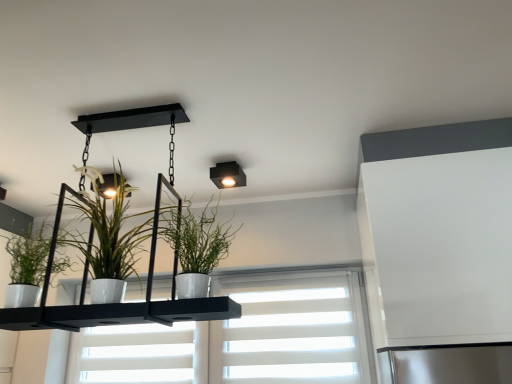
The width and height of the screenshot is (512, 384). What do you see at coordinates (26, 267) in the screenshot? I see `green matte plant at left, placed as the third houseplant when sorted from right to left` at bounding box center [26, 267].

The width and height of the screenshot is (512, 384). What do you see at coordinates (228, 175) in the screenshot? I see `matte black square light fixture at upper center` at bounding box center [228, 175].

Describe the element at coordinates (103, 234) in the screenshot. I see `white glossy pot at center, the 2th houseplant from the left` at that location.

Where is `green matte plant at left, placed as the third houseplant when sorted from right to left`? The width and height of the screenshot is (512, 384). green matte plant at left, placed as the third houseplant when sorted from right to left is located at coordinates (26, 267).

Considering the sizes of white glossy pot at center, which appears as the second houseplant when viewed from the right, and matte black square light fixture at upper center in the image, is white glossy pot at center, which appears as the second houseplant when viewed from the right, taller or shorter than matte black square light fixture at upper center?

Considering their sizes, white glossy pot at center, which appears as the second houseplant when viewed from the right, has more height than matte black square light fixture at upper center.

Considering the relative positions of white glossy pot at center, the 2th houseplant from the left, and matte black square light fixture at upper center in the image provided, is white glossy pot at center, the 2th houseplant from the left, to the right of matte black square light fixture at upper center from the viewer's perspective?

In fact, white glossy pot at center, the 2th houseplant from the left, is to the left of matte black square light fixture at upper center.

Is there a large distance between white glossy pot at center, which appears as the second houseplant when viewed from the right, and matte black square light fixture at upper center?

They are positioned close to each other.

What's the angular difference between white matte window at center and white glossy pot at center, marked as the first houseplant in a right-to-left arrangement,'s facing directions?

The facing directions of white matte window at center and white glossy pot at center, marked as the first houseplant in a right-to-left arrangement, are 7.87 degrees apart.

What are the coordinates of `window below the white glossy pot at center, marked as the first houseplant in a right-to-left arrangement (from the image's perspective)` in the screenshot? It's located at (248, 335).

Is white matte window at center beside white glossy pot at center, marked as the first houseplant in a right-to-left arrangement?

No, white matte window at center is not with white glossy pot at center, marked as the first houseplant in a right-to-left arrangement.

From their relative heights in the image, would you say white matte window at center is taller or shorter than white glossy pot at center, marked as the first houseplant in a right-to-left arrangement?

Considering their sizes, white matte window at center has more height than white glossy pot at center, marked as the first houseplant in a right-to-left arrangement.

From the image's perspective, which one is positioned higher, matte black square light fixture at upper center or white matte window at center?

matte black square light fixture at upper center appears higher in the image.

Identify the location of window that appears behind the matte black square light fixture at upper center. (248, 335).

Is matte black square light fixture at upper center taller or shorter than white matte window at center?

matte black square light fixture at upper center is shorter than white matte window at center.

Can you confirm if white glossy pot at center, which appears as the second houseplant when viewed from the right, is bigger than green matte plant at left, the first houseplant from the left?

Yes.

Is white glossy pot at center, the 2th houseplant from the left, next to green matte plant at left, placed as the third houseplant when sorted from right to left, and touching it?

white glossy pot at center, the 2th houseplant from the left, and green matte plant at left, placed as the third houseplant when sorted from right to left, are not in contact.

Can you confirm if white glossy pot at center, the 2th houseplant from the left, is thinner than green matte plant at left, the first houseplant from the left?

No, white glossy pot at center, the 2th houseplant from the left, is not thinner than green matte plant at left, the first houseplant from the left.

Which houseplant is the 1st one when counting from the right side of the green matte plant at left, placed as the third houseplant when sorted from right to left? Please provide its 2D coordinates.

[(103, 234)]

Is white matte window at center next to matte black square light fixture at upper center and touching it?

No, white matte window at center is not with matte black square light fixture at upper center.

You are a GUI agent. You are given a task and a screenshot of the screen. Output one action in this format:
    pyautogui.click(x=<x>, y=<y>)
    Task: Click on the window below the matte black square light fixture at upper center (from the image's perspective)
    The width and height of the screenshot is (512, 384).
    Given the screenshot: What is the action you would take?
    pyautogui.click(x=248, y=335)

Between point (265, 381) and point (215, 181), which one is positioned in front?

The point (215, 181) is closer to the camera.

Considering the relative sizes of white matte window at center and matte black square light fixture at upper center in the image provided, is white matte window at center wider than matte black square light fixture at upper center?

No.

From the picture: Is matte black square light fixture at upper center bigger or smaller than white glossy pot at center, which appears as the second houseplant when viewed from the right?

Considering their sizes, matte black square light fixture at upper center takes up less space than white glossy pot at center, which appears as the second houseplant when viewed from the right.

Considering the relative positions of matte black square light fixture at upper center and white glossy pot at center, which appears as the second houseplant when viewed from the right, in the image provided, is matte black square light fixture at upper center to the left or to the right of white glossy pot at center, which appears as the second houseplant when viewed from the right,?

In the image, matte black square light fixture at upper center appears on the right side of white glossy pot at center, which appears as the second houseplant when viewed from the right.

From the image's perspective, who appears lower, matte black square light fixture at upper center or white glossy pot at center, which appears as the second houseplant when viewed from the right?

From the image's view, white glossy pot at center, which appears as the second houseplant when viewed from the right, is below.

Can you tell me how much matte black square light fixture at upper center and white glossy pot at center, which appears as the second houseplant when viewed from the right, differ in facing direction?

2.07 degrees.

In the image, is white matte window at center positioned in front of or behind green matte plant at left, the first houseplant from the left?

white matte window at center is behind green matte plant at left, the first houseplant from the left.

There is a white matte window at center. Where is `the 1st houseplant above it (from a real-world perspective)`? This screenshot has width=512, height=384. the 1st houseplant above it (from a real-world perspective) is located at coordinates (26, 267).

In terms of size, does white matte window at center appear bigger or smaller than green matte plant at left, the first houseplant from the left?

In the image, white matte window at center appears to be larger than green matte plant at left, the first houseplant from the left.

Can you confirm if white matte window at center is taller than green matte plant at left, placed as the third houseplant when sorted from right to left?

Indeed, white matte window at center has a greater height compared to green matte plant at left, placed as the third houseplant when sorted from right to left.

The height and width of the screenshot is (384, 512). What are the coordinates of `the 3rd houseplant in front of the matte black square light fixture at upper center` in the screenshot? It's located at (103, 234).

Where is `window below the white glossy pot at center, which is the third houseplant in left-to-right order (from the image's perspective)`? This screenshot has height=384, width=512. window below the white glossy pot at center, which is the third houseplant in left-to-right order (from the image's perspective) is located at coordinates 248,335.

Looking at this image, considering their positions, is white glossy pot at center, marked as the first houseplant in a right-to-left arrangement, positioned closer to white matte window at center than matte black square light fixture at upper center?

matte black square light fixture at upper center is positioned closer to the anchor white matte window at center.

Based on their spatial positions, is white glossy pot at center, which appears as the second houseplant when viewed from the right, or white glossy pot at center, marked as the first houseplant in a right-to-left arrangement, further from green matte plant at left, placed as the third houseplant when sorted from right to left?

white glossy pot at center, marked as the first houseplant in a right-to-left arrangement, is positioned further to the anchor green matte plant at left, placed as the third houseplant when sorted from right to left.

Estimate the real-world distances between objects in this image. Which object is closer to green matte plant at left, placed as the third houseplant when sorted from right to left, white glossy pot at center, the 2th houseplant from the left, or white matte window at center?

The object closer to green matte plant at left, placed as the third houseplant when sorted from right to left, is white glossy pot at center, the 2th houseplant from the left.

Looking at the image, which one is located closer to green matte plant at left, placed as the third houseplant when sorted from right to left, white matte window at center or white glossy pot at center, the 2th houseplant from the left?

white glossy pot at center, the 2th houseplant from the left, is positioned closer to the anchor green matte plant at left, placed as the third houseplant when sorted from right to left.

Looking at the image, which one is located further to white matte window at center, white glossy pot at center, the 2th houseplant from the left, or matte black square light fixture at upper center?

Based on the image, white glossy pot at center, the 2th houseplant from the left, appears to be further to white matte window at center.

Estimate the real-world distances between objects in this image. Which object is further from white matte window at center, white glossy pot at center, which appears as the second houseplant when viewed from the right, or green matte plant at left, the first houseplant from the left?

Among the two, green matte plant at left, the first houseplant from the left, is located further to white matte window at center.

When comparing their distances from white glossy pot at center, marked as the first houseplant in a right-to-left arrangement, does white matte window at center or white glossy pot at center, the 2th houseplant from the left, seem further?

white matte window at center lies further to white glossy pot at center, marked as the first houseplant in a right-to-left arrangement, than the other object.

Which object lies nearer to the anchor point green matte plant at left, placed as the third houseplant when sorted from right to left, white glossy pot at center, which is the third houseplant in left-to-right order, or matte black square light fixture at upper center?

white glossy pot at center, which is the third houseplant in left-to-right order, lies closer to green matte plant at left, placed as the third houseplant when sorted from right to left, than the other object.

This screenshot has height=384, width=512. Identify the location of light fixture between white glossy pot at center, which is the third houseplant in left-to-right order, and white matte window at center in the front-back direction. (228, 175).

Identify the location of houseplant located between white glossy pot at center, marked as the first houseplant in a right-to-left arrangement, and matte black square light fixture at upper center in the depth direction. The width and height of the screenshot is (512, 384). tap(26, 267).

The height and width of the screenshot is (384, 512). In order to click on light fixture positioned between white glossy pot at center, which appears as the second houseplant when viewed from the right, and white matte window at center from near to far in this screenshot , I will do `click(228, 175)`.

This screenshot has height=384, width=512. In order to click on houseplant between green matte plant at left, the first houseplant from the left, and white glossy pot at center, marked as the first houseplant in a right-to-left arrangement, from left to right in this screenshot , I will do `click(103, 234)`.